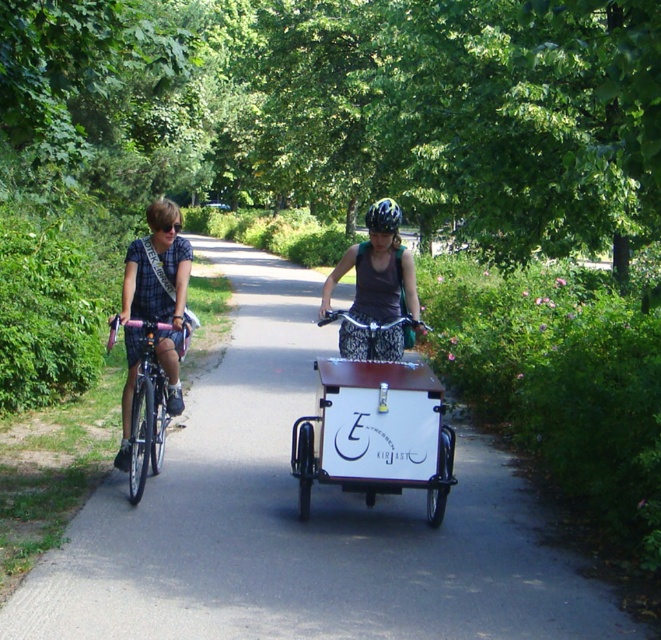
Can you confirm if matte purple tank top at center is smaller than blue patterned helmet at center?

Correct, matte purple tank top at center occupies less space than blue patterned helmet at center.

Does point (379, 212) lie in front of point (381, 228)?

Yes, it is in front of point (381, 228).

This screenshot has width=661, height=640. Describe the element at coordinates (377, 288) in the screenshot. I see `matte purple tank top at center` at that location.

Where is `matte purple tank top at center`? The height and width of the screenshot is (640, 661). matte purple tank top at center is located at coordinates (377, 288).

Is matte purple tank top at center to the right of shiny metallic bicycle at left from the viewer's perspective?

Correct, you'll find matte purple tank top at center to the right of shiny metallic bicycle at left.

Can you confirm if matte purple tank top at center is positioned above shiny metallic bicycle at left?

Indeed, matte purple tank top at center is positioned over shiny metallic bicycle at left.

Is point (368, 298) in front of point (157, 333)?

No, it is behind (157, 333).

I want to click on matte purple tank top at center, so point(377,288).

Is the position of white matte cargo bike at center less distant than that of blue patterned helmet at center?

Yes, it is in front of blue patterned helmet at center.

Who is lower down, white matte cargo bike at center or blue patterned helmet at center?

white matte cargo bike at center is below.

Which is behind, point (260, 589) or point (379, 212)?

Point (379, 212)

You are a GUI agent. You are given a task and a screenshot of the screen. Output one action in this format:
    pyautogui.click(x=<x>, y=<y>)
    Task: Click on the white matte cargo bike at center
    The height and width of the screenshot is (640, 661).
    Given the screenshot: What is the action you would take?
    pyautogui.click(x=297, y=522)